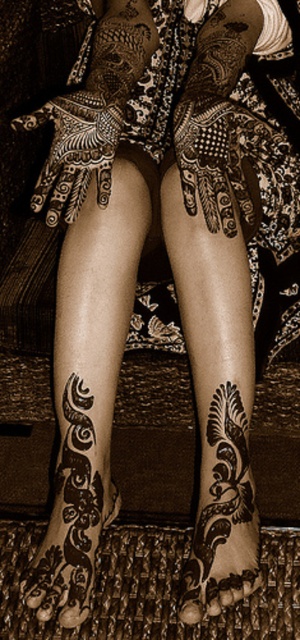
Question: Among these points, which one is nearest to the camera?

Choices:
 (A) (108, 506)
 (B) (122, 540)
 (C) (210, 516)

Answer: (C)

Question: Observing the image, what is the correct spatial positioning of brown henna tattoo at lower left in reference to black henna tattoo at lower center?

Choices:
 (A) below
 (B) above

Answer: (B)

Question: Is brown henna tattoo at lower left below black henna tattoo at lower center?

Choices:
 (A) no
 (B) yes

Answer: (A)

Question: Does brown henna tattoo at lower left have a smaller size compared to black henna tattoo at lower center?

Choices:
 (A) no
 (B) yes

Answer: (A)

Question: Which point is farther from the camera taking this photo?

Choices:
 (A) (243, 444)
 (B) (137, 611)
 (C) (84, 365)

Answer: (A)

Question: Which point is farther to the camera?

Choices:
 (A) coord(237,529)
 (B) coord(60,452)
 (C) coord(101,586)

Answer: (B)